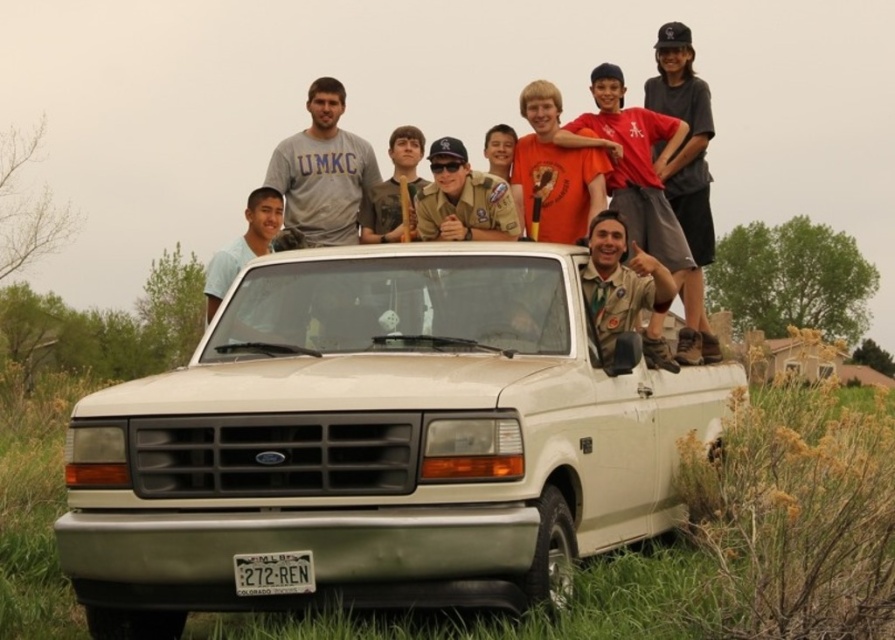
You are a photographer trying to capture a photo of the white matte pickup truck at center and the matte khaki uniform at center. Since the truck is taller than the uniform, where should you position yourself to ensure both subjects are fully visible in the frame?

Since the white matte pickup truck at center is taller than the matte khaki uniform at center, you should position yourself at a lower angle to capture both subjects fully in the frame, ensuring the truck doesn not block the uniform from view.

You are a photographer standing 10 feet away from the white matte pickup truck at center and the matte khaki uniform at center. You want to take a photo of both objects in focus. Since the distance between them is less than 10 feet, will you be able to capture both in focus with a standard camera lens set to an aperture of f8?

The white matte pickup truck at center is 33.19 inches away from the matte khaki uniform at center. Since 33.19 inches is less than 10 feet, which is 120 inches, the distance between them is within the acceptable range for a standard camera lens at f8 to keep both objects in focus.